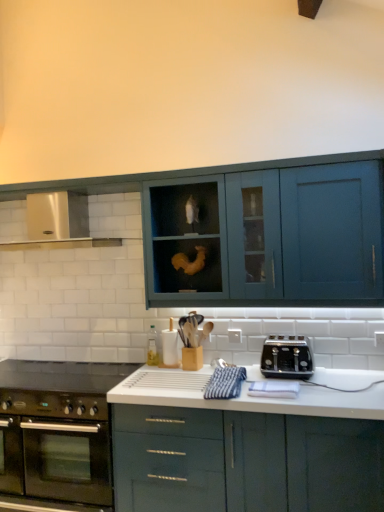
Identify the location of free point to the right of satin silver toaster at right. (346, 371).